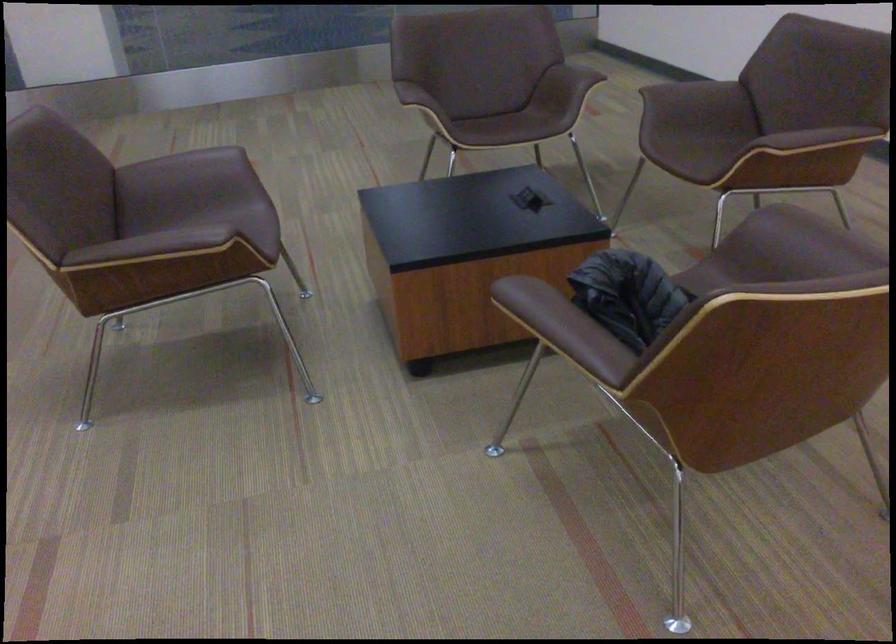
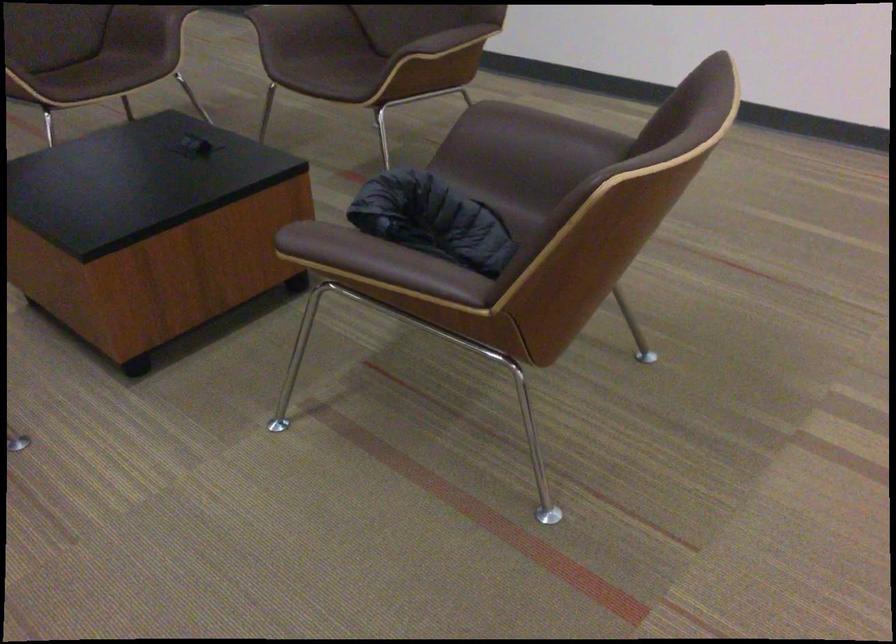
Locate, in the second image, the point that corresponds to the point at 546,305 in the first image.

(355, 250)